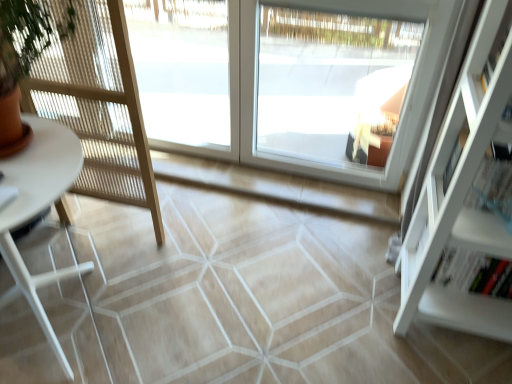
Locate an element on the screen. The image size is (512, 384). free area below white glossy table at left (from a real-world perspective) is located at coordinates pyautogui.click(x=53, y=328).